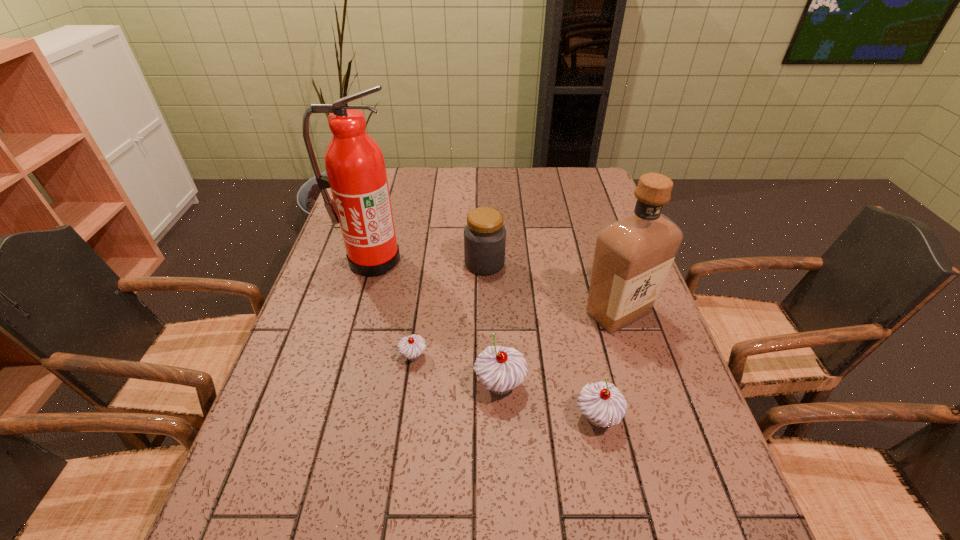
Please point a spot on the right to add another cupcake. Please provide its 2D coordinates. Your answer should be formatted as a tuple, i.e. [(x, y)], where the tuple contains the x and y coordinates of a point satisfying the conditions above.

[(709, 454)]